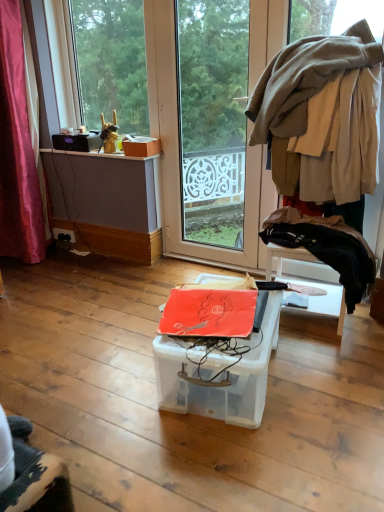
Question: Is transparent plastic box at center inside or outside of matte orange box at upper left?

Choices:
 (A) outside
 (B) inside

Answer: (A)

Question: From the image's perspective, is transparent plastic box at center above or below matte orange box at upper left?

Choices:
 (A) above
 (B) below

Answer: (B)

Question: Based on their relative distances, which object is farther from the transparent glass screen door at center?

Choices:
 (A) transparent plastic box at center
 (B) black plastic power outlet at lower left
 (C) transparent glass window at upper left
 (D) matte orange box at upper left
 (E) beige woolen sweater at upper right, acting as the 2th clothing starting from the bottom

Answer: (A)

Question: Estimate the real-world distances between objects in this image. Which object is closer to the transparent glass screen door at center?

Choices:
 (A) transparent glass window at upper left
 (B) black fabric at right, which is the second clothing from top to bottom
 (C) black plastic power outlet at lower left
 (D) matte orange box at upper left
 (E) matte cardboard box at upper left

Answer: (E)